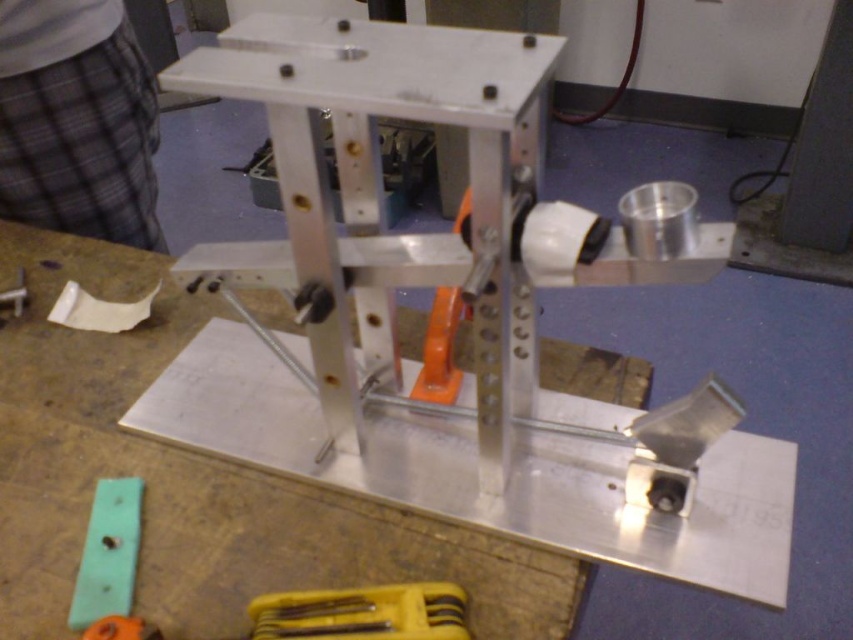
Who is more forward, (123, 349) or (453, 625)?

Point (453, 625) is more forward.

From the picture: Between metallic silver table at center and yellow plastic tool at lower center, which one is positioned higher?

metallic silver table at center

Locate an element on the screen. metallic silver table at center is located at coordinates (200, 483).

What are the coordinates of `metallic silver table at center` in the screenshot? It's located at (200, 483).

Looking at this image, which is more to the left, yellow plastic tool at lower center or matte plastic ruler at lower left?

Positioned to the left is matte plastic ruler at lower left.

Between yellow plastic tool at lower center and matte plastic ruler at lower left, which one has more height?

matte plastic ruler at lower left

Where is `yellow plastic tool at lower center`? The image size is (853, 640). yellow plastic tool at lower center is located at coordinates [x=363, y=612].

Where is `yellow plastic tool at lower center`? This screenshot has height=640, width=853. yellow plastic tool at lower center is located at coordinates (363, 612).

Can you confirm if metallic silver table at center is positioned above green plastic ruler at lower left?

Yes.

Is metallic silver table at center taller than green plastic ruler at lower left?

Yes, metallic silver table at center is taller than green plastic ruler at lower left.

The image size is (853, 640). What are the coordinates of `metallic silver table at center` in the screenshot? It's located at (200, 483).

This screenshot has height=640, width=853. Identify the location of metallic silver table at center. (200, 483).